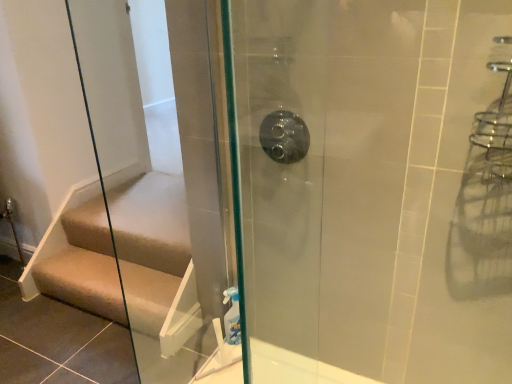
Question: Looking at their shapes, would you say matte silver showerhead at center is wider or thinner than brown leather stairs at lower left?

Choices:
 (A) wide
 (B) thin

Answer: (B)

Question: Looking at the image, does matte silver showerhead at center seem bigger or smaller compared to brown leather stairs at lower left?

Choices:
 (A) big
 (B) small

Answer: (B)

Question: Is point (295, 140) positioned closer to the camera than point (74, 276)?

Choices:
 (A) farther
 (B) closer

Answer: (B)

Question: Relative to matte silver showerhead at center, is brown leather stairs at lower left in front or behind?

Choices:
 (A) behind
 (B) front

Answer: (A)

Question: Visually, is brown leather stairs at lower left positioned to the left or to the right of matte silver showerhead at center?

Choices:
 (A) right
 (B) left

Answer: (B)

Question: In terms of width, does brown leather stairs at lower left look wider or thinner when compared to matte silver showerhead at center?

Choices:
 (A) thin
 (B) wide

Answer: (B)

Question: From the image's perspective, is brown leather stairs at lower left positioned above or below matte silver showerhead at center?

Choices:
 (A) below
 (B) above

Answer: (A)